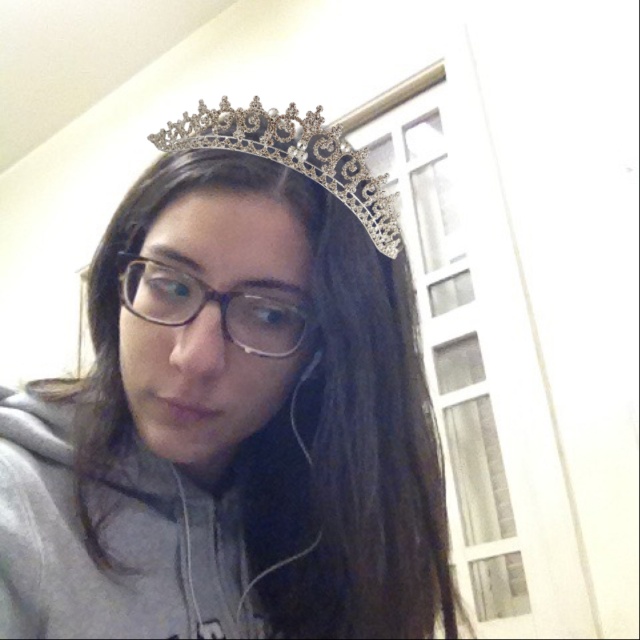
Question: Which object is positioned closest to the transparent plastic glasses at center?

Choices:
 (A) silver metallic crown at upper center
 (B) silver metallic tiara at upper center

Answer: (B)

Question: Estimate the real-world distances between objects in this image. Which object is farther from the transparent plastic glasses at center?

Choices:
 (A) silver metallic crown at upper center
 (B) silver metallic tiara at upper center

Answer: (A)

Question: Does silver metallic crown at upper center appear under silver metallic tiara at upper center?

Choices:
 (A) no
 (B) yes

Answer: (B)

Question: Is silver metallic tiara at upper center smaller than transparent plastic glasses at center?

Choices:
 (A) no
 (B) yes

Answer: (A)

Question: Which point is farther to the camera?

Choices:
 (A) (x=256, y=636)
 (B) (x=198, y=104)
 (C) (x=246, y=300)

Answer: (A)

Question: Is silver metallic crown at upper center above transparent plastic glasses at center?

Choices:
 (A) yes
 (B) no

Answer: (B)